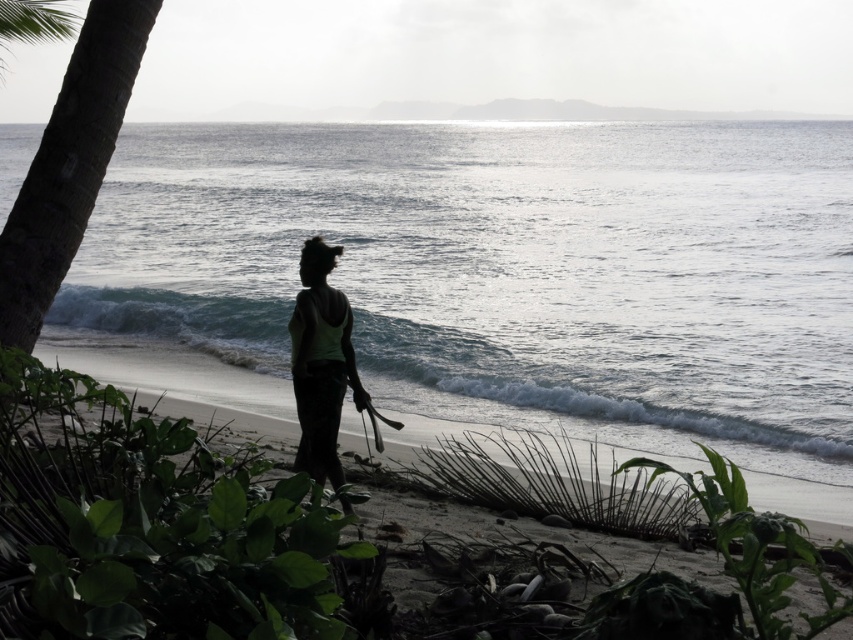
Question: Where is glistening silver water at center located in relation to green leafy plant at center in the image?

Choices:
 (A) right
 (B) left

Answer: (A)

Question: Which of the following is the closest to the observer?

Choices:
 (A) (148, 29)
 (B) (115, 371)
 (C) (305, 412)

Answer: (C)

Question: Can you confirm if glistening silver water at center is positioned above silhouette sand at lower center?

Choices:
 (A) no
 (B) yes

Answer: (B)

Question: Considering the real-world distances, which object is farthest from the silhouette fabric woman at center?

Choices:
 (A) brown rough palm tree at left
 (B) glistening silver water at center

Answer: (B)

Question: From the image, what is the correct spatial relationship of silhouette sand at lower center in relation to silhouette fabric woman at center?

Choices:
 (A) right
 (B) left

Answer: (B)

Question: Which object is the farthest from the silhouette sand at lower center?

Choices:
 (A) silhouette fabric woman at center
 (B) brown rough palm tree at left

Answer: (B)